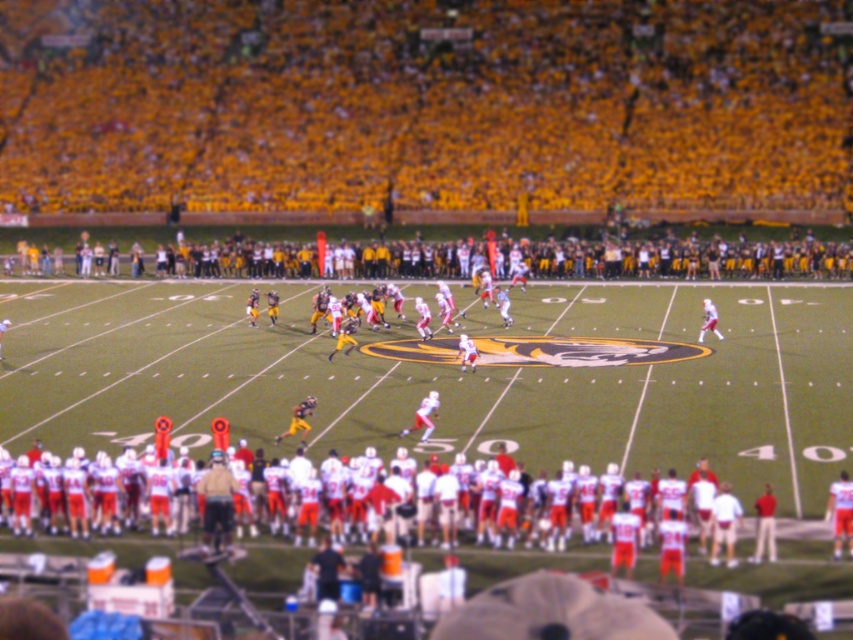
Question: Can you confirm if yellow fabric seats at upper center is positioned above white fabric football team at lower center?

Choices:
 (A) no
 (B) yes

Answer: (B)

Question: Which object is farther from the camera taking this photo?

Choices:
 (A) yellow fabric seats at upper center
 (B) white fabric football team at lower center

Answer: (A)

Question: Which of the following is the farthest from the observer?

Choices:
 (A) yellow fabric seats at upper center
 (B) white fabric football team at lower center

Answer: (A)

Question: Can you confirm if yellow fabric seats at upper center is positioned to the left of white fabric football team at lower center?

Choices:
 (A) yes
 (B) no

Answer: (A)

Question: Is yellow fabric seats at upper center closer to camera compared to white fabric football team at lower center?

Choices:
 (A) no
 (B) yes

Answer: (A)